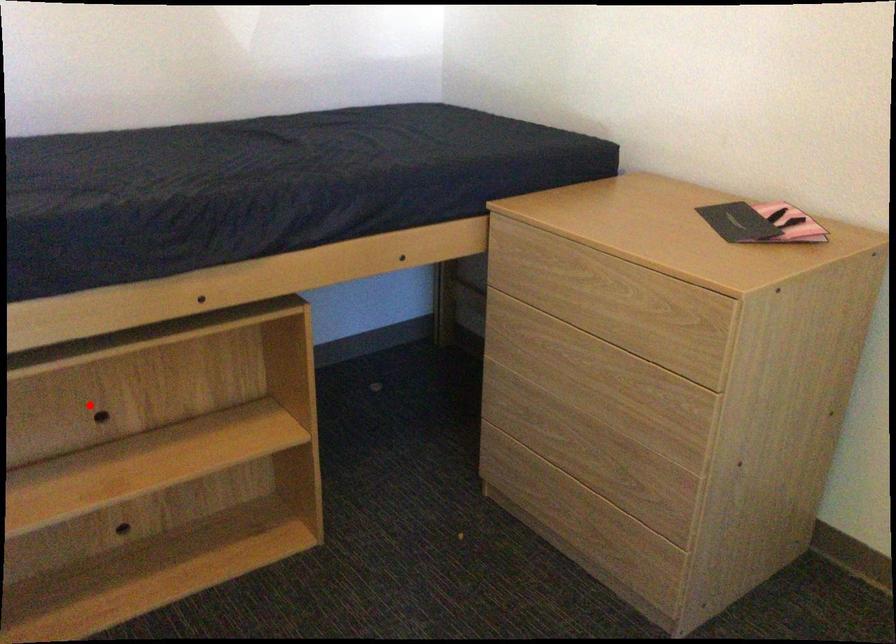
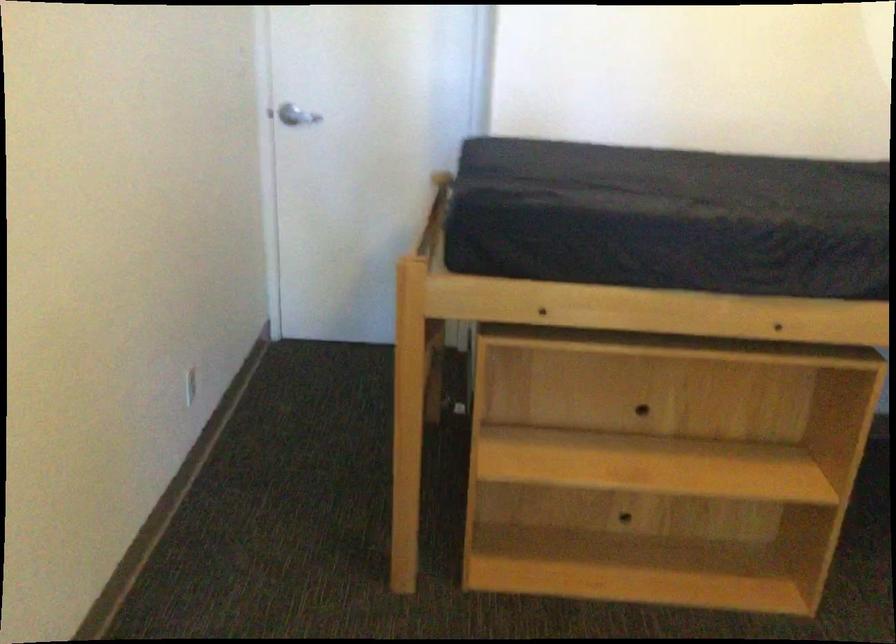
Where in the second image is the point corresponding to the highlighted location from the first image?

(633, 395)